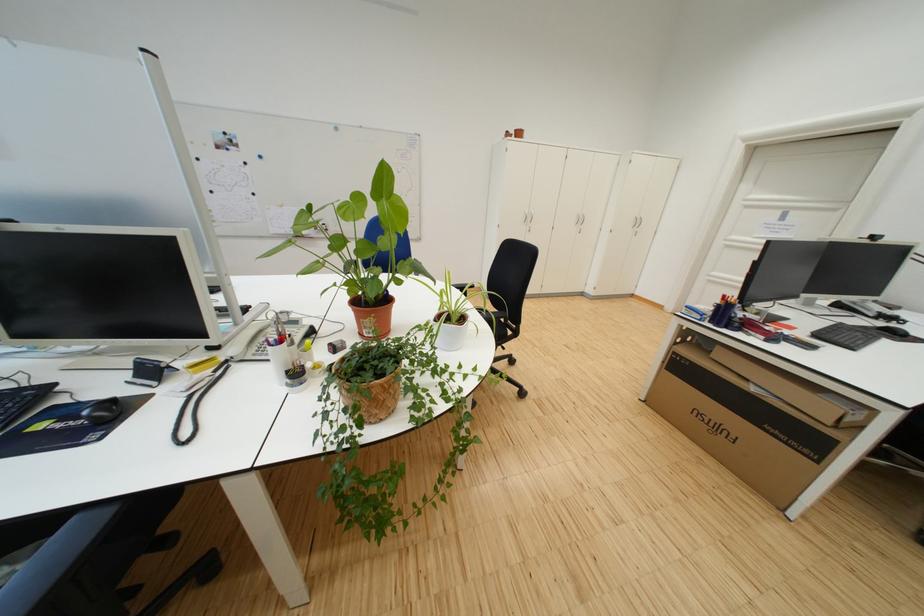
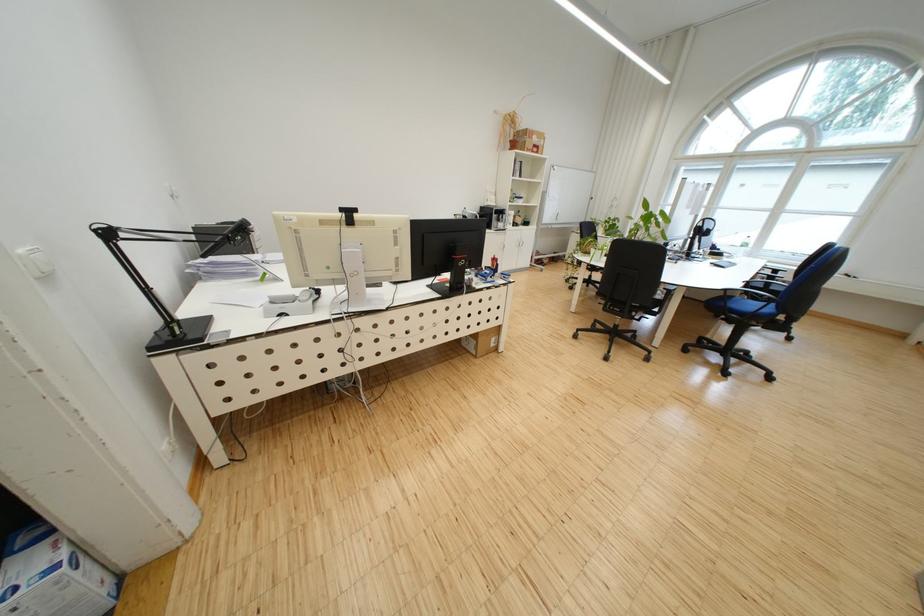
Question: I am providing you with two images of the same scene from different viewpoints. Which of the following objects are not visible in image2?

Choices:
 (A) blue and white box
 (B) yellow highlighter
 (C) silver cabinet handle
 (D) small ironing board

Answer: (B)